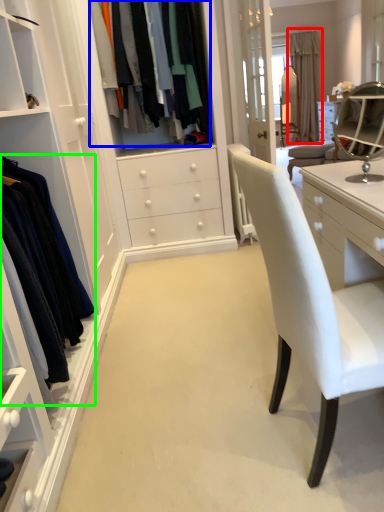
Question: Considering the real-world distances, which object is farthest from curtain (highlighted by a red box)? clothing (highlighted by a blue box) or clothing (highlighted by a green box)?

Choices:
 (A) clothing
 (B) clothing

Answer: (B)